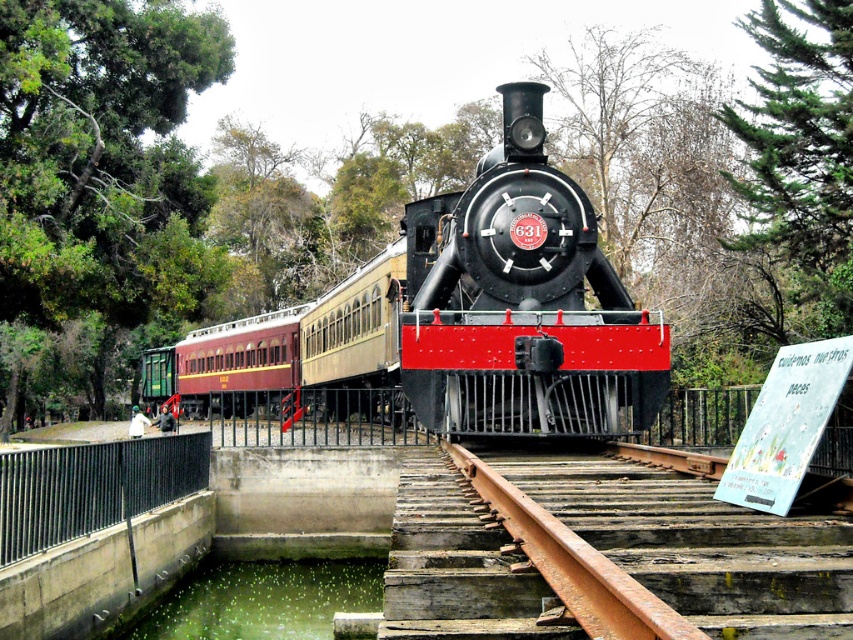
You are standing in front of the vintage steam locomotive at the center of the image. You notice two points marked on the train set. The first point is at coordinates point (376, 305) and the second point is at point (614, 611). Which of these two points is closer to you?

Point (376, 305) is further to the viewer than point (614, 611), so the point closer to you is point (614, 611).

In the scene shown: You are standing in front of the vintage steam locomotive at the center of the image. You notice two points marked on the tracks ahead of you. The first point is at coordinates point (x=318, y=348) and the second is at point (x=96, y=518). Which point is closer to you?

Point (x=318, y=348) is closer to you because it is further to the viewer than point (x=96, y=518).